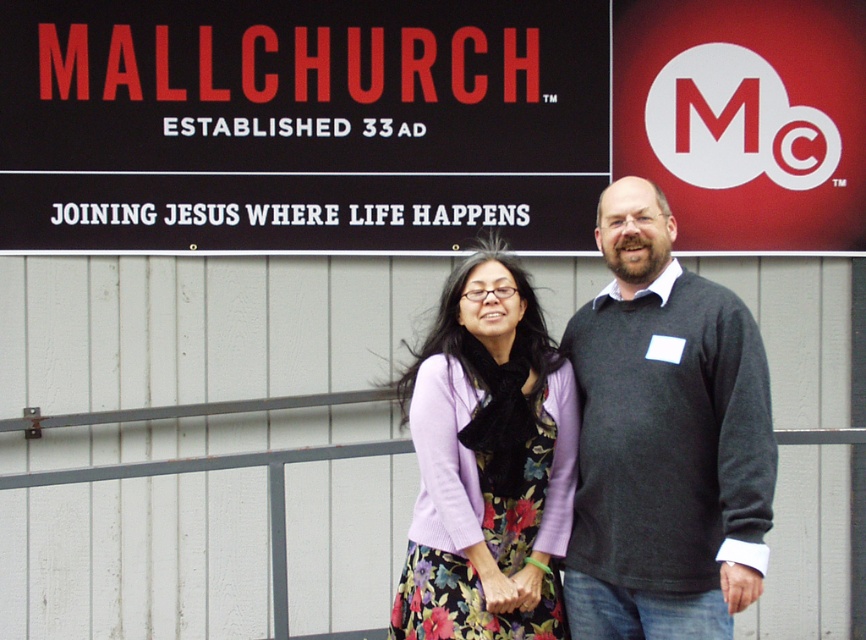
Who is higher up, black sign at upper center or purple knitted sweater at center?

black sign at upper center is higher up.

Is black sign at upper center shorter than purple knitted sweater at center?

Yes, black sign at upper center is shorter than purple knitted sweater at center.

Is point (335, 72) closer to camera compared to point (472, 513)?

No, it is not.

At what (x,y) coordinates should I click in order to perform the action: click on black sign at upper center. Please return your answer as a coordinate pair (x, y). Looking at the image, I should click on (427, 122).

Is black sign at upper center to the left of dark gray sweater at center from the viewer's perspective?

Correct, you'll find black sign at upper center to the left of dark gray sweater at center.

Who is taller, black sign at upper center or dark gray sweater at center?

dark gray sweater at center is taller.

This screenshot has height=640, width=866. Find the location of `black sign at upper center`. black sign at upper center is located at coordinates (427, 122).

Is dark gray sweater at center above purple knitted sweater at center?

Yes.

Between point (578, 324) and point (473, 403), which one is positioned in front?

Point (473, 403)

I want to click on dark gray sweater at center, so click(x=664, y=440).